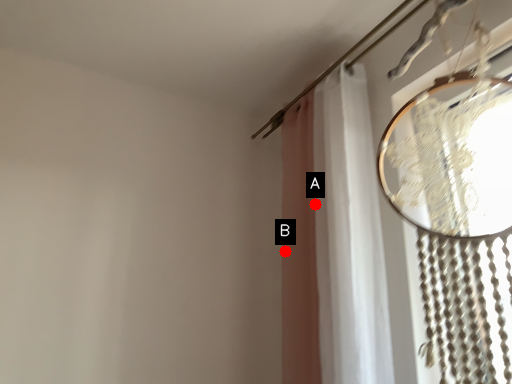
Question: Two points are circled on the image, labeled by A and B beside each circle. Which point is closer to the camera taking this photo?

Choices:
 (A) A is closer
 (B) B is closer

Answer: (A)